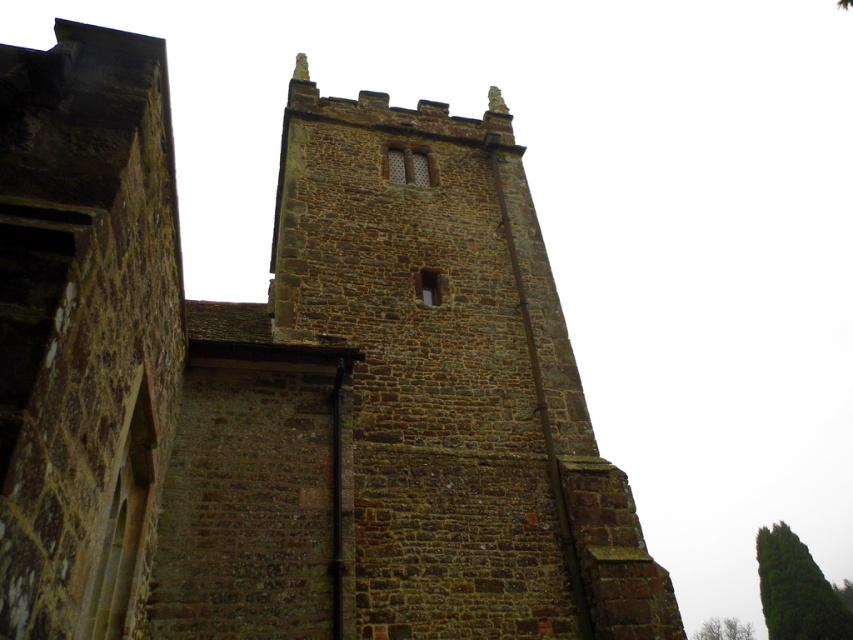
Is green leafy tree at upper right to the left of green leafy tree at lower right from the viewer's perspective?

Yes, green leafy tree at upper right is to the left of green leafy tree at lower right.

Find the location of a particular element. This screenshot has width=853, height=640. green leafy tree at upper right is located at coordinates (796, 589).